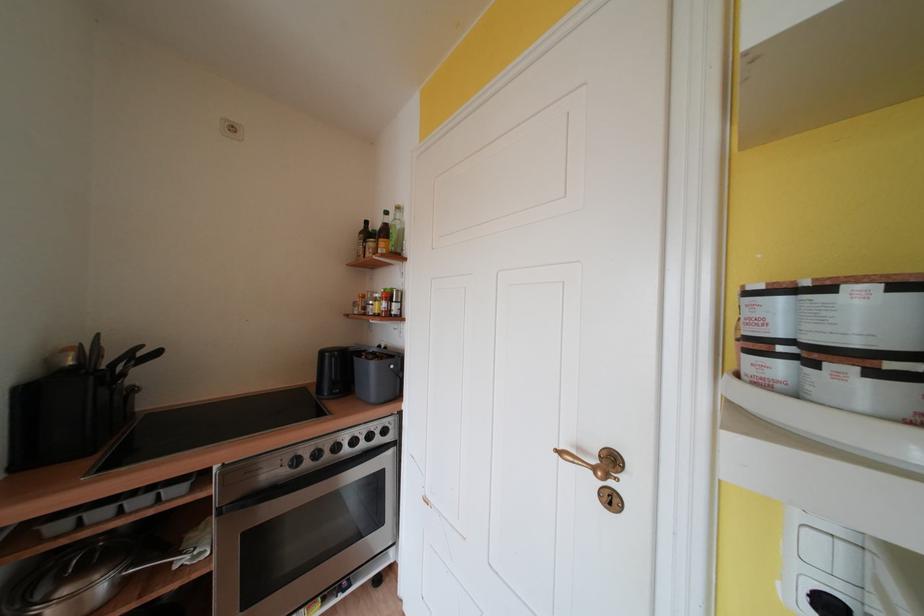
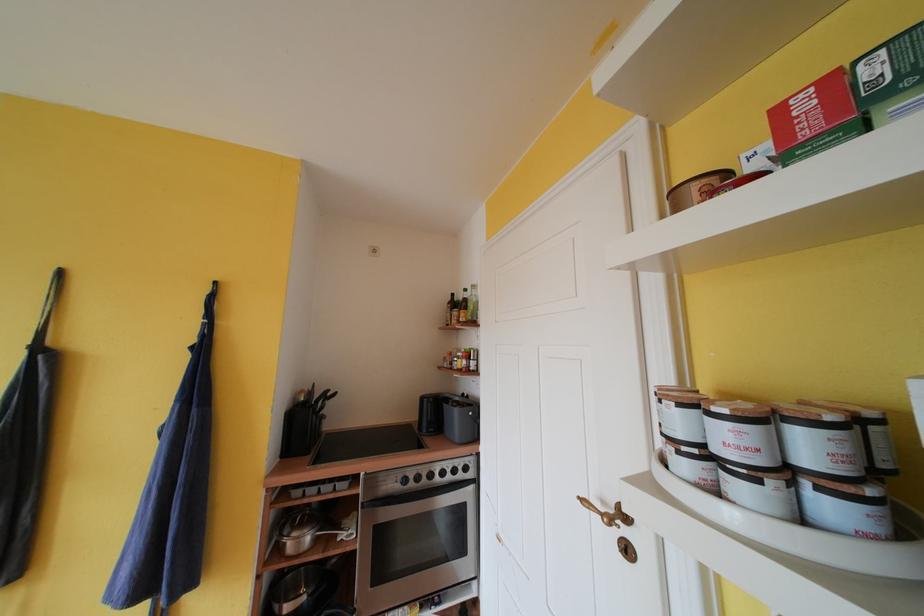
The images are taken continuously from a first-person perspective. In which direction are you moving?

The cameraman walked toward right, backward.